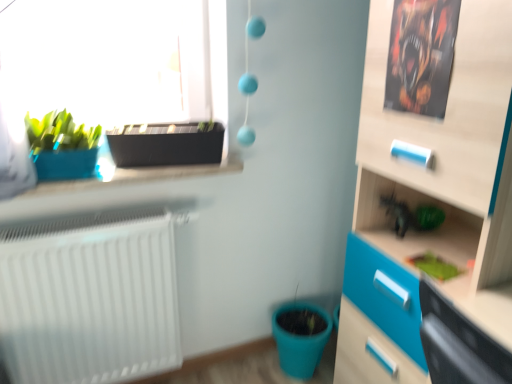
Question: In the image, is matte plastic flowerpot at lower center, the second flowerpot in the top-to-bottom sequence, on the left side or the right side of green matte plant at lower right?

Choices:
 (A) right
 (B) left

Answer: (B)

Question: Considering their positions, is matte plastic flowerpot at lower center, the second flowerpot when ordered from front to back, located in front of or behind green matte plant at lower right?

Choices:
 (A) front
 (B) behind

Answer: (B)

Question: Which object is the farthest from the black plastic flowerpot at upper left, the second flowerpot in the bottom-to-top sequence?

Choices:
 (A) green matte plant at lower right
 (B) matte plastic flowerpot at lower center, the second flowerpot positioned from the left
 (C) matte blue pot at left

Answer: (B)

Question: Based on their relative distances, which object is farther from the green matte plant at lower right?

Choices:
 (A) black plastic flowerpot at upper left, the first flowerpot viewed from the top
 (B) matte blue pot at left
 (C) matte plastic flowerpot at lower center, the 1th flowerpot positioned from the back

Answer: (B)